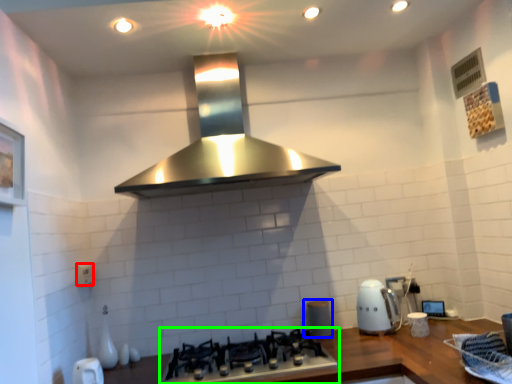
Question: Which is farther away from electric outlet (highlighted by a red box)? appliance (highlighted by a blue box) or gas stove (highlighted by a green box)?

Choices:
 (A) appliance
 (B) gas stove

Answer: (A)